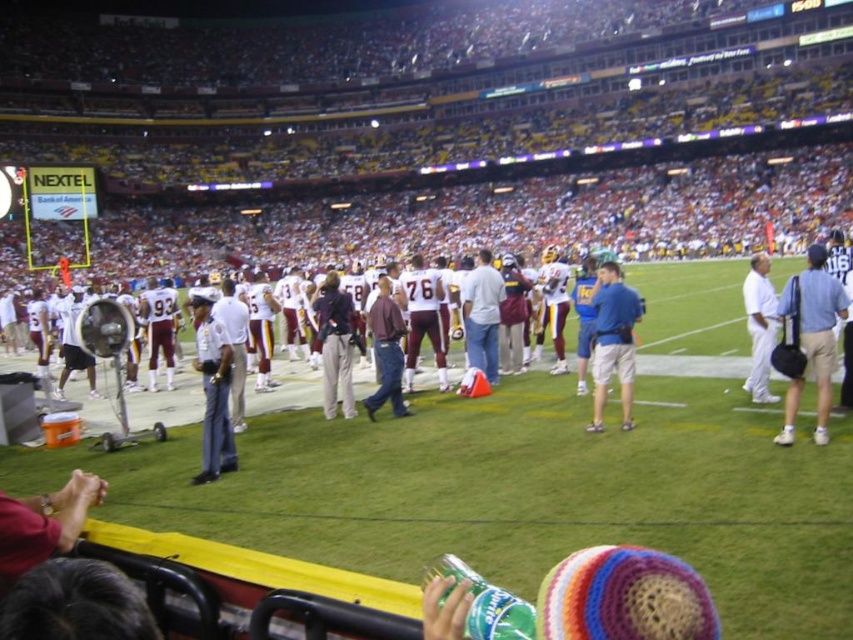
You are a photographer at the football stadium trying to capture a photo of both the maroon fabric shirt at center and the white cotton shirt at right. Based on their positions, which shirt will appear closer to the bottom of the photo?

The maroon fabric shirt at center is positioned under the white cotton shirt at right, so it will appear closer to the bottom of the photo.

You are a photographer at the football stadium. You want to take a photo of the metallic silver fan at center. Where should you position yourself to capture it in the frame?

You should position yourself at point (112, 362) to capture the metallic silver fan at center in the frame.

You are a photographer at the football stadium and need to capture a group photo of the maroon fabric shirt at center and the white cotton shirt at right. Considering their sizes, which shirt should you position closer to the camera to ensure both appear equally sized in the photo?

The maroon fabric shirt at center is wider than the white cotton shirt at right. To make them appear the same size in the photo, position the white cotton shirt at right closer to the camera since it is smaller in width.